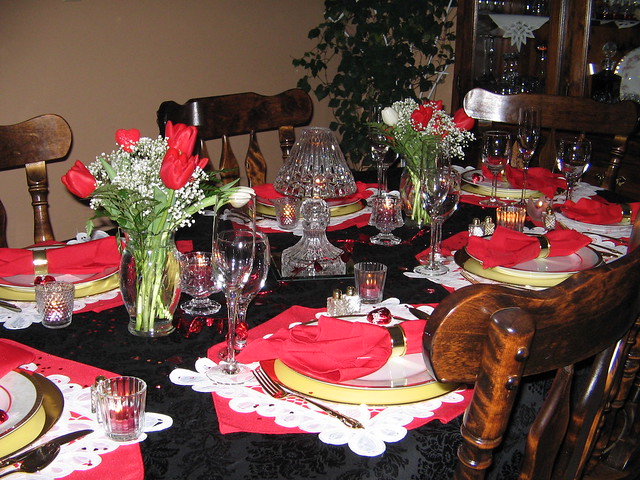
The width and height of the screenshot is (640, 480). I want to click on white placemats, so click(x=321, y=427), click(x=68, y=452), click(x=22, y=318), click(x=329, y=223), click(x=454, y=279), click(x=588, y=189).